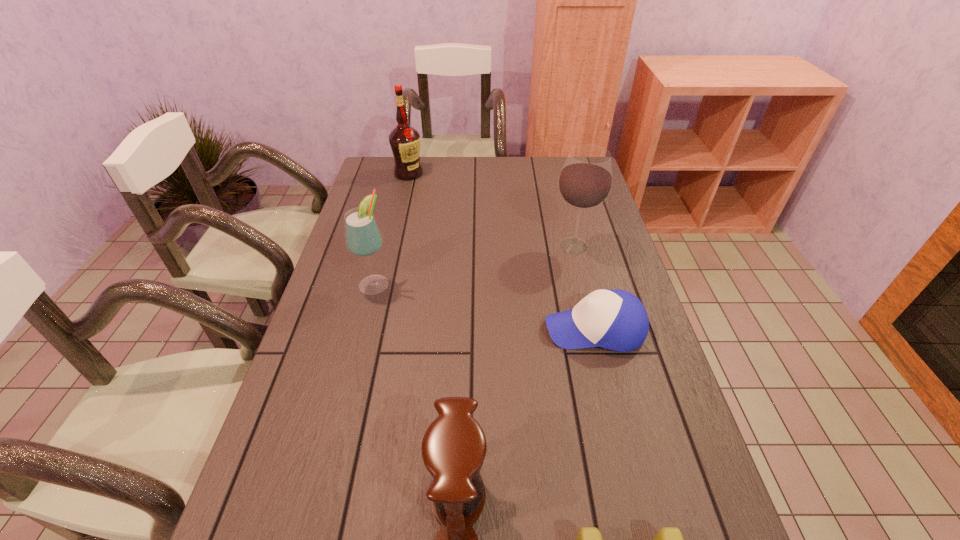
Identify the location of the farthest object. (404, 140).

You are a GUI agent. You are given a task and a screenshot of the screen. Output one action in this format:
    pyautogui.click(x=<x>, y=<y>)
    Task: Click on the second nearest alcohol
    The image size is (960, 540).
    Given the screenshot: What is the action you would take?
    pyautogui.click(x=585, y=181)

Find the location of `the rightmost alcohol`. the rightmost alcohol is located at coordinates (585, 181).

Locate an element on the screen. the third farthest object is located at coordinates (363, 238).

Locate an element on the screen. the third nearest object is located at coordinates (616, 320).

Find the location of a particular element. This screenshot has height=540, width=960. baseball cap is located at coordinates (616, 320).

The height and width of the screenshot is (540, 960). I want to click on free space located 0.120m on the label of the farthest alcohol, so click(x=403, y=199).

Find the location of a particular element. This screenshot has height=540, width=960. vacant space located on the front of the rightmost alcohol is located at coordinates (582, 278).

This screenshot has height=540, width=960. Identify the location of vacant space located on the back of the fourth nearest object. click(x=383, y=251).

You are a GUI agent. You are given a task and a screenshot of the screen. Output one action in this format:
    pyautogui.click(x=<x>, y=<y>)
    Task: Click on the free space located on the front-facing side of the third nearest object
    The width and height of the screenshot is (960, 540).
    Given the screenshot: What is the action you would take?
    pyautogui.click(x=452, y=329)